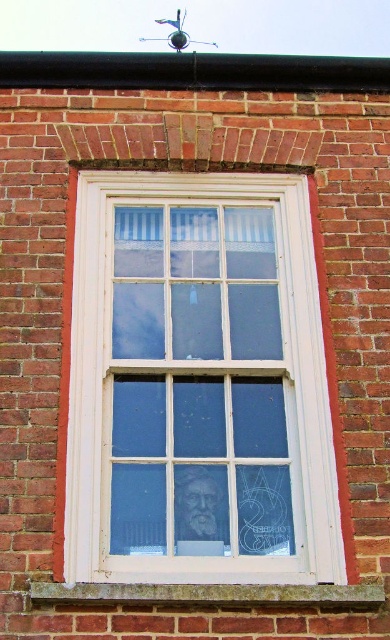
Question: Is white wood window frame at center above stone at lower center?

Choices:
 (A) yes
 (B) no

Answer: (A)

Question: Which of the following is the closest to the observer?

Choices:
 (A) (308, 228)
 (B) (271, 595)

Answer: (B)

Question: Which point is farther to the camera?

Choices:
 (A) (251, 605)
 (B) (134, 189)

Answer: (B)

Question: Is white wood window frame at center above stone at lower center?

Choices:
 (A) yes
 (B) no

Answer: (A)

Question: Is white wood window frame at center to the right of stone at lower center from the viewer's perspective?

Choices:
 (A) yes
 (B) no

Answer: (B)

Question: Which of the following is the farthest from the observer?

Choices:
 (A) white wood window frame at center
 (B) stone at lower center

Answer: (A)